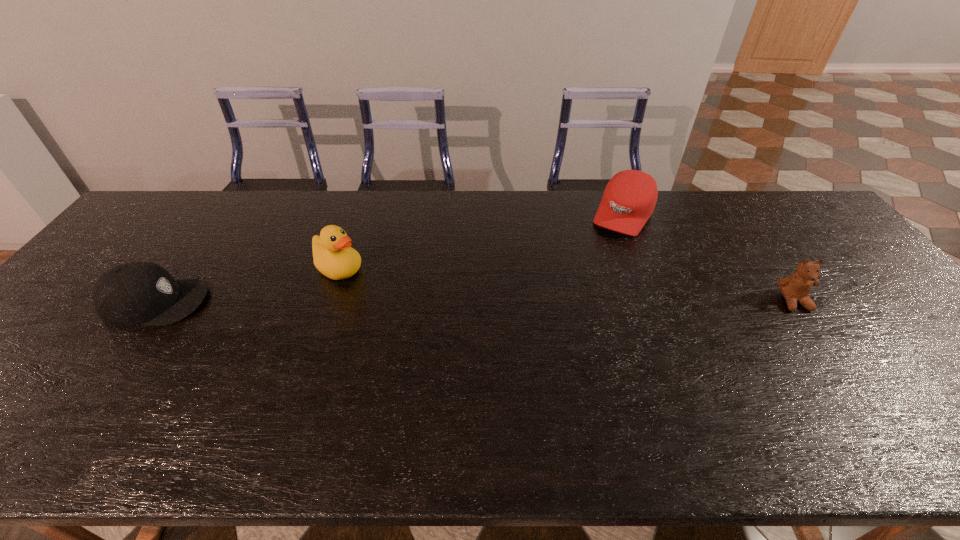
You are a GUI agent. You are given a task and a screenshot of the screen. Output one action in this format:
    pyautogui.click(x=<x>, y=<y>)
    Task: Click on the vacant region at the far left corner of the desktop
    This screenshot has width=960, height=540.
    Given the screenshot: What is the action you would take?
    pyautogui.click(x=145, y=215)

You are a GUI agent. You are given a task and a screenshot of the screen. Output one action in this format:
    pyautogui.click(x=<x>, y=<y>)
    Task: Click on the empty space that is in between the second object from left to right and the nearer cap
    
    Given the screenshot: What is the action you would take?
    pyautogui.click(x=248, y=286)

Find the location of a particular element. This screenshot has width=960, height=540. free spot between the duck and the rightmost object is located at coordinates (566, 285).

Identify the location of empty location between the second object from right to left and the tallest object. (481, 242).

The image size is (960, 540). What are the coordinates of `free space between the right cap and the tallest object` in the screenshot? It's located at (481, 242).

This screenshot has width=960, height=540. I want to click on vacant region between the duck and the rightmost object, so click(566, 285).

The height and width of the screenshot is (540, 960). Identify the location of vacant space that's between the teddy bear and the leftmost object. (474, 302).

Find the location of a particular element. vacant space in between the nearer cap and the teddy bear is located at coordinates (474, 302).

Locate an element on the screen. The image size is (960, 540). vacant area that lies between the second object from right to left and the nearer cap is located at coordinates tap(390, 259).

Locate an element on the screen. The width and height of the screenshot is (960, 540). free space between the rightmost object and the right cap is located at coordinates (708, 258).